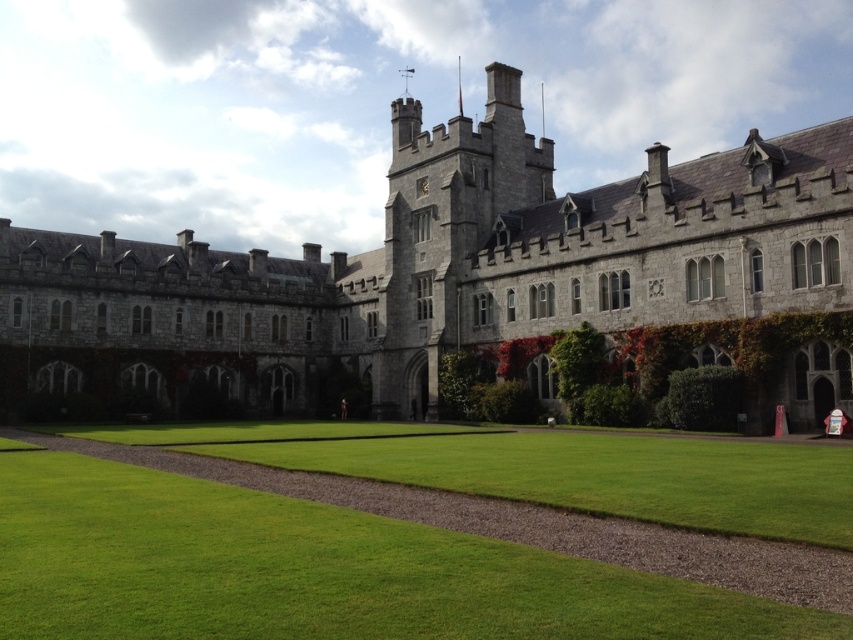
Who is shorter, gray stone castle at center or green grass at center?

green grass at center

Between gray stone castle at center and green grass at center, which one is positioned lower?

green grass at center is lower down.

Which is behind, point (664, 150) or point (399, 609)?

The point (664, 150) is behind.

Locate an element on the screen. gray stone castle at center is located at coordinates (437, 268).